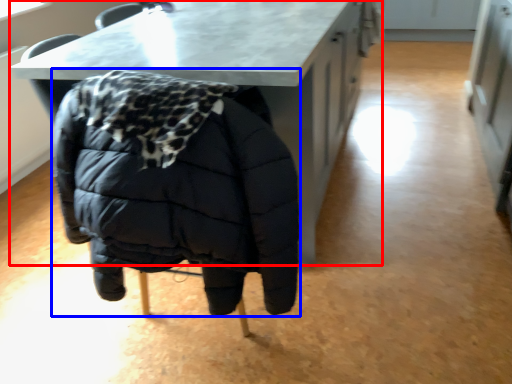
Question: Which point is closer to the camera, table (highlighted by a red box) or jacket (highlighted by a blue box)?

Choices:
 (A) table
 (B) jacket

Answer: (B)